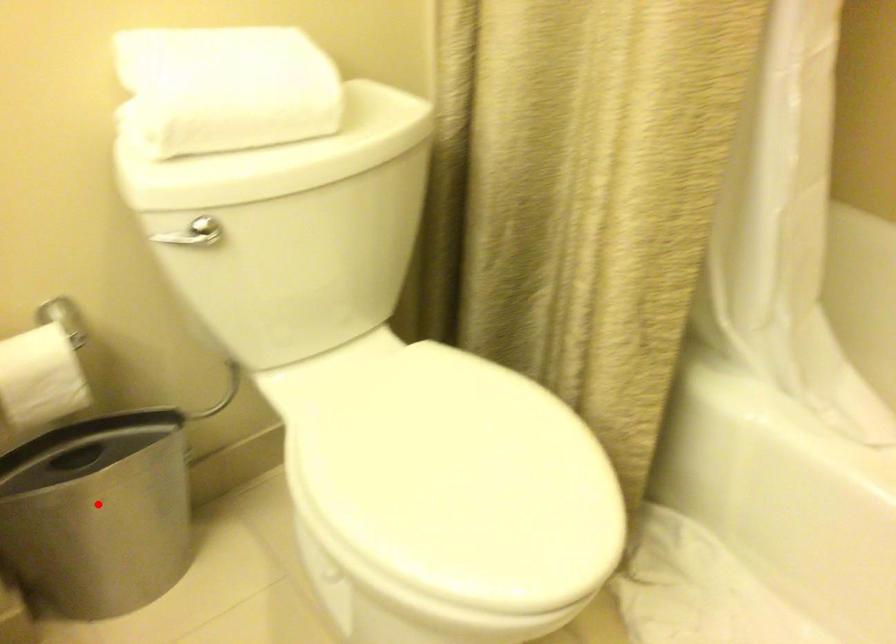
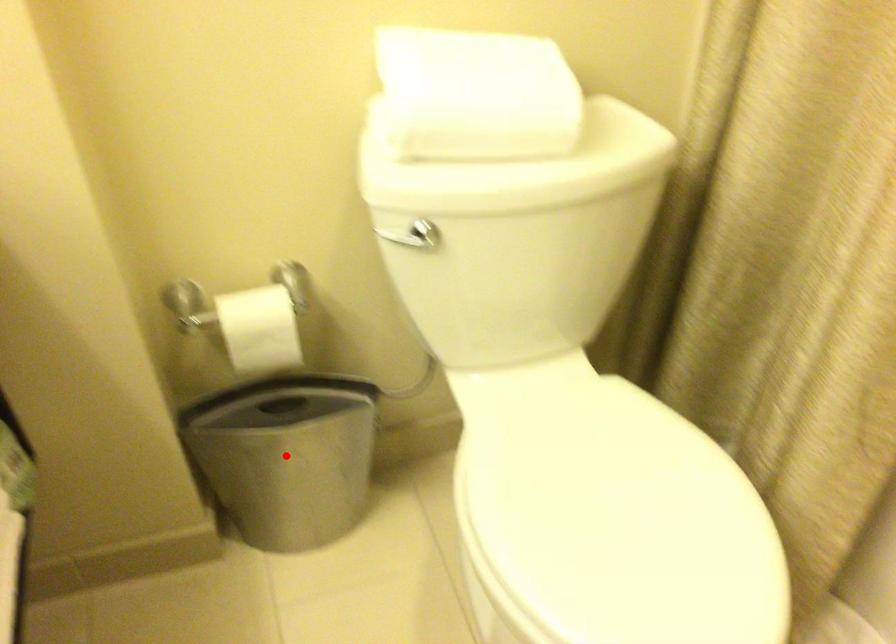
I am providing you with two images of the same scene from different viewpoints. A red point is marked on the first image and another point is marked on the second image. Is the marked point in image1 the same physical position as the marked point in image2?

Yes